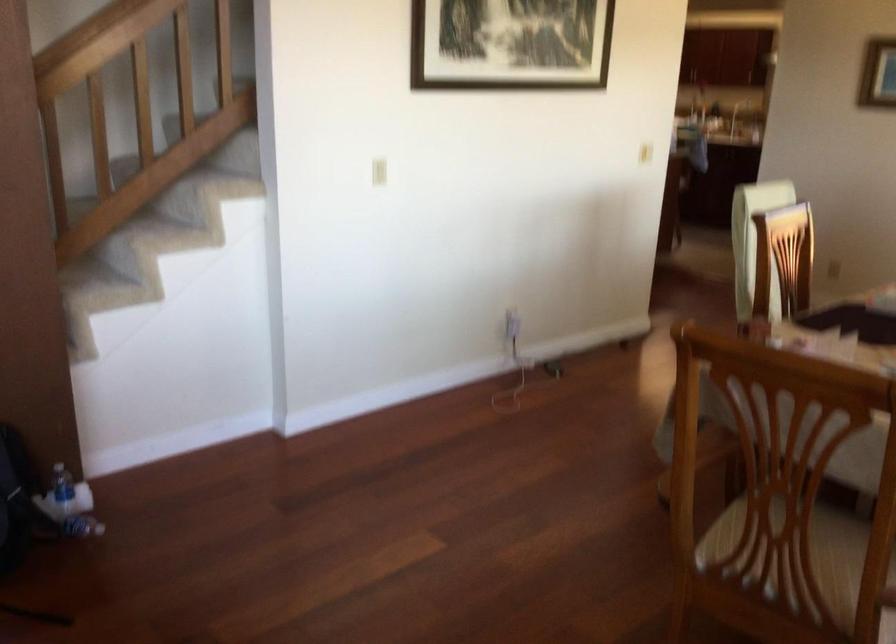
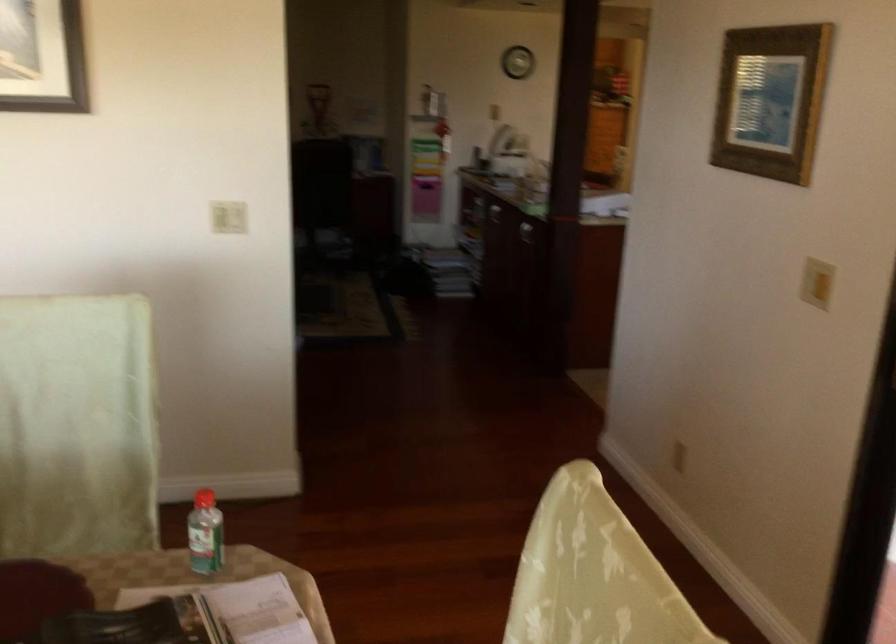
Locate, in the second image, the point that corresponds to (x=642, y=144) in the first image.

(228, 216)